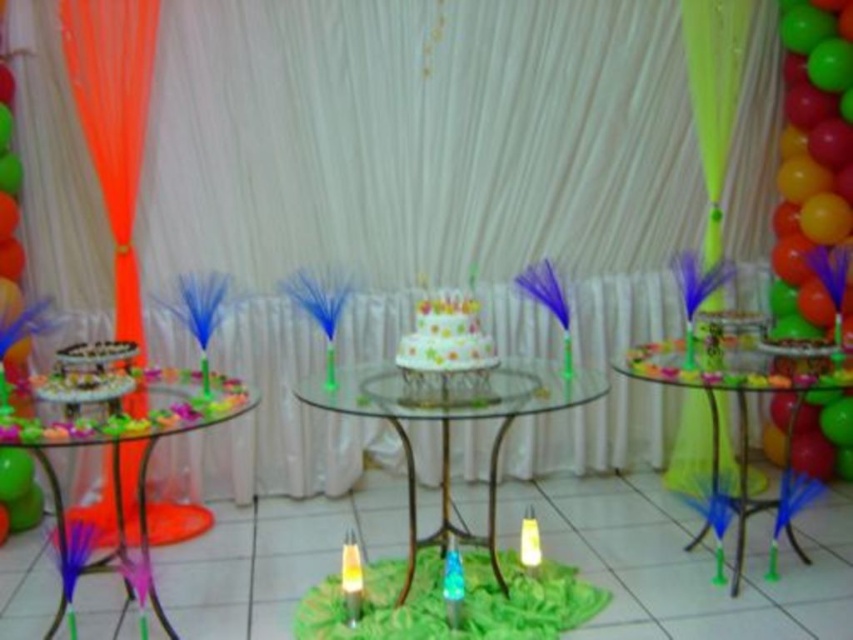
Question: Which of the following is the farthest from the observer?

Choices:
 (A) translucent glass table at center
 (B) translucent glass cake stand at center
 (C) white matte candle at center
 (D) yellow translucent candle at center

Answer: (C)

Question: Is white glossy cake at center smaller than white matte candle at center?

Choices:
 (A) yes
 (B) no

Answer: (B)

Question: Which point is closer to the camera?

Choices:
 (A) (421, 355)
 (B) (350, 589)
 (C) (680, 364)
 (D) (524, 512)

Answer: (A)

Question: Which point is farther to the camera?

Choices:
 (A) translucent glass table at center
 (B) translucent glass cake stand at center

Answer: (A)

Question: Is translucent glass table at center closer to camera compared to yellow translucent candle at center?

Choices:
 (A) no
 (B) yes

Answer: (B)

Question: Does translucent glass cake stand at center have a smaller size compared to translucent glass table at center?

Choices:
 (A) yes
 (B) no

Answer: (B)